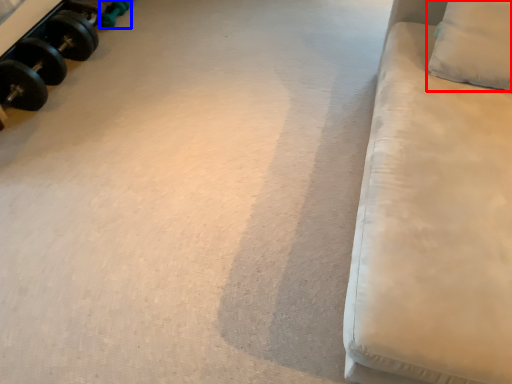
Question: Which point is further to the camera, pillow (highlighted by a red box) or dumbbell (highlighted by a blue box)?

Choices:
 (A) pillow
 (B) dumbbell

Answer: (B)